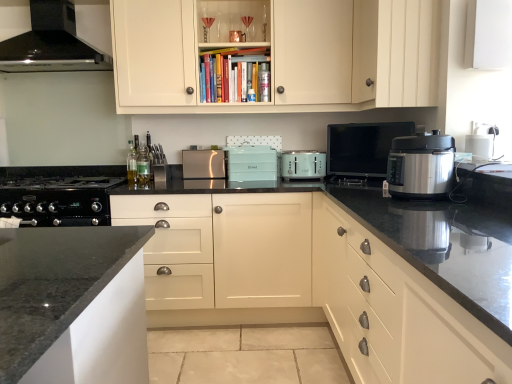
You are a GUI agent. You are given a task and a screenshot of the screen. Output one action in this format:
    pyautogui.click(x=<x>, y=<y>)
    Task: Click on the vacant space to the right of translucent glass bottle at center, positioned as the second bottle in left-to-right order
    
    Given the screenshot: What is the action you would take?
    pyautogui.click(x=166, y=182)